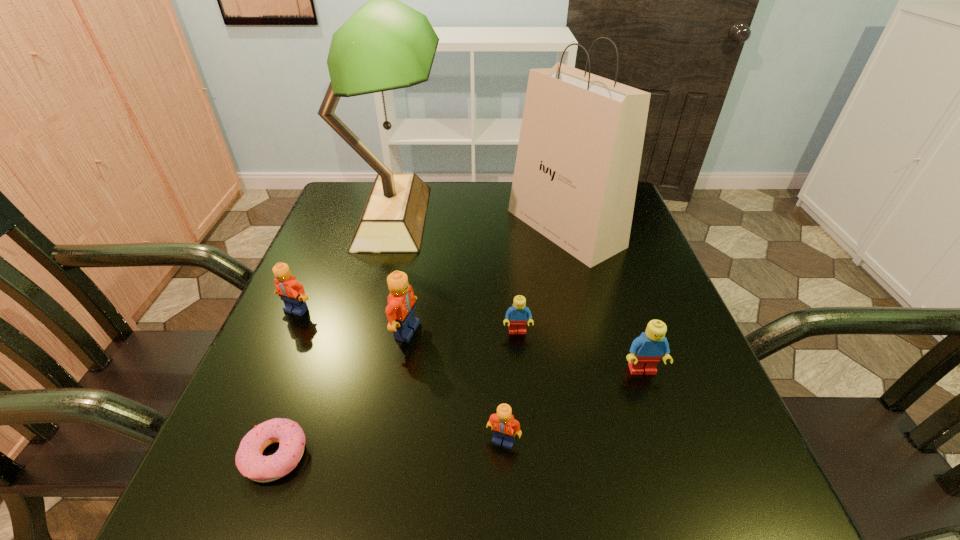
I want to click on object that is at the far left corner, so click(385, 45).

You are a GUI agent. You are given a task and a screenshot of the screen. Output one action in this format:
    pyautogui.click(x=<x>, y=<y>)
    Task: Click on the object at the near left corner
    This screenshot has width=960, height=540.
    Given the screenshot: What is the action you would take?
    pyautogui.click(x=250, y=462)

I want to click on object positioned at the far right corner, so click(x=579, y=153).

At what (x,y) coordinates should I click in order to perform the action: click on free region at the far edge. Please return your answer as a coordinate pair (x, y). Looking at the image, I should click on (465, 213).

At what (x,y) coordinates should I click in order to perform the action: click on free region at the near edge. Please return your answer as a coordinate pair (x, y). Looking at the image, I should click on [x=588, y=489].

This screenshot has width=960, height=540. Identify the location of vacant point at the left edge. (304, 283).

Image resolution: width=960 pixels, height=540 pixels. In order to click on free region at the right edge of the desktop in this screenshot , I will do `click(697, 456)`.

Identify the location of free space between the left blue Lego and the rightmost orange Lego. This screenshot has height=540, width=960. (511, 386).

Where is `unoccupied area between the smallest orange Lego and the doughnut`? unoccupied area between the smallest orange Lego and the doughnut is located at coordinates (390, 448).

Where is `free area in between the smallest orange Lego and the second smallest orange Lego`? free area in between the smallest orange Lego and the second smallest orange Lego is located at coordinates (400, 375).